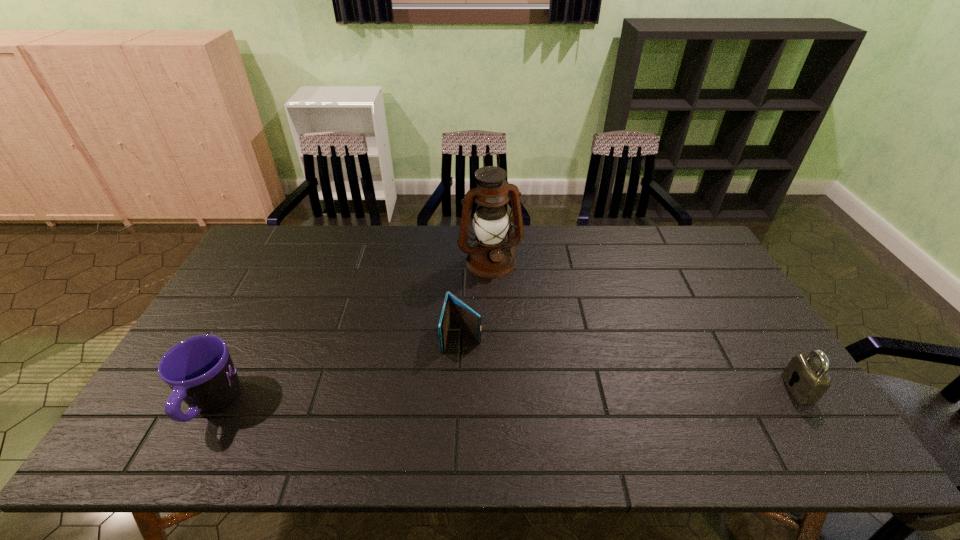
You are a GUI agent. You are given a task and a screenshot of the screen. Output one action in this format:
    pyautogui.click(x=<x>, y=<y>)
    Task: Click on the vacant space that satisfies the following two spatial constraints: 1. on the back side of the lantern; 2. on the right side of the shortest object
    Image resolution: width=960 pixels, height=540 pixels.
    Given the screenshot: What is the action you would take?
    pyautogui.click(x=465, y=262)

At what (x,y) coordinates should I click in order to perform the action: click on vacant region that satisfies the following two spatial constraints: 1. on the front side of the lantern; 2. at the front of the rightmost object near the keyhole. Please return your answer as a coordinate pair (x, y). This screenshot has height=540, width=960. Looking at the image, I should click on (494, 388).